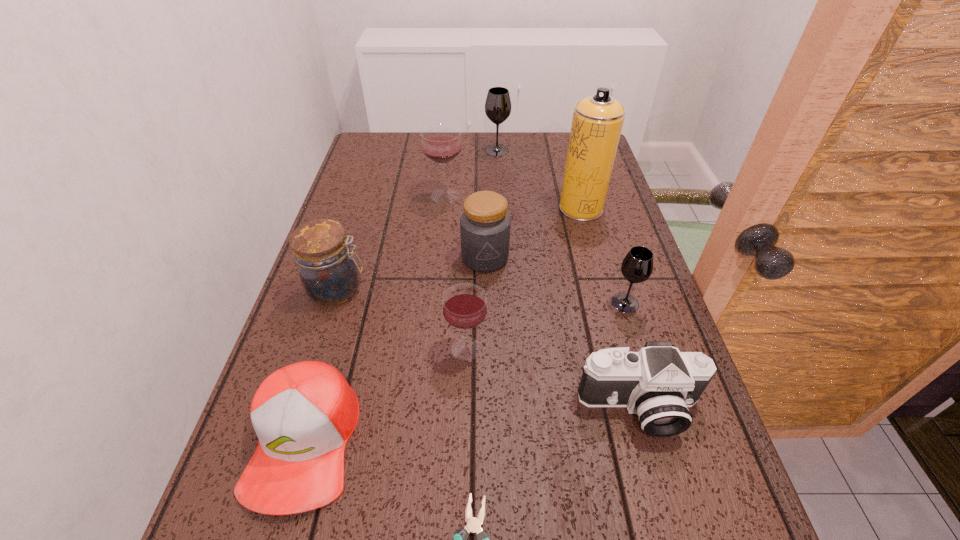
I want to click on aerosol can, so click(597, 122).

Where is `the third nearest wineglass`? the third nearest wineglass is located at coordinates tap(441, 142).

Identify the location of the farther red wineglass. The height and width of the screenshot is (540, 960). (441, 142).

I want to click on the farthest object, so click(498, 104).

Where is `the farther gray wineglass`? This screenshot has height=540, width=960. the farther gray wineglass is located at coordinates (498, 104).

You are a GUI agent. You are given a task and a screenshot of the screen. Output one action in this format:
    pyautogui.click(x=<x>, y=<y>)
    Task: Click on the gray jar
    This screenshot has height=540, width=960.
    Given the screenshot: What is the action you would take?
    pyautogui.click(x=485, y=224)

You are a GUI agent. You are given a task and a screenshot of the screen. Output one action in this format:
    pyautogui.click(x=<x>, y=<y>)
    Task: Click on the left jar
    The height and width of the screenshot is (540, 960).
    Given the screenshot: What is the action you would take?
    pyautogui.click(x=328, y=272)

The image size is (960, 540). In order to click on the nearer red wineglass in this screenshot , I will do `click(464, 307)`.

Identify the location of the fourth nearest object. (464, 307).

I want to click on the smaller gray wineglass, so click(x=637, y=266).